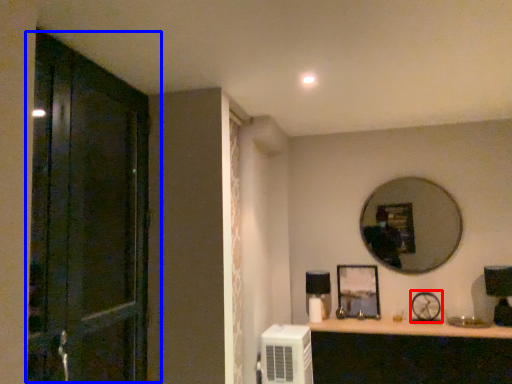
Question: Which object is further to the camera taking this photo, oval (highlighted by a red box) or door (highlighted by a blue box)?

Choices:
 (A) oval
 (B) door

Answer: (A)